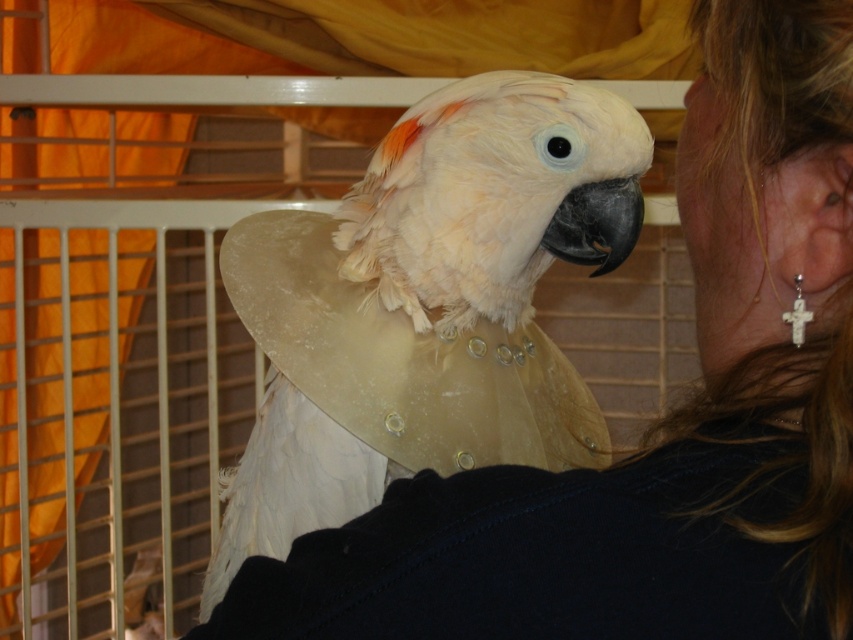
Question: Is white cross earring at right smaller than white ceramic cross at ear?

Choices:
 (A) no
 (B) yes

Answer: (A)

Question: Is white cross earring at right wider than white ceramic cross at ear?

Choices:
 (A) no
 (B) yes

Answer: (B)

Question: Which point is closer to the camera?

Choices:
 (A) white feathered parrot at center
 (B) white cross earring at right
 (C) white ceramic cross at ear

Answer: (B)

Question: Is black glossy beak at center thinner than white ceramic cross at ear?

Choices:
 (A) no
 (B) yes

Answer: (A)

Question: Which object appears farthest from the camera in this image?

Choices:
 (A) white cross earring at right
 (B) white ceramic cross at ear
 (C) white feathered parrot at center

Answer: (C)

Question: Among these objects, which one is farthest from the camera?

Choices:
 (A) white cross earring at right
 (B) black glossy beak at center
 (C) white feathered parrot at center
 (D) white ceramic cross at ear

Answer: (B)